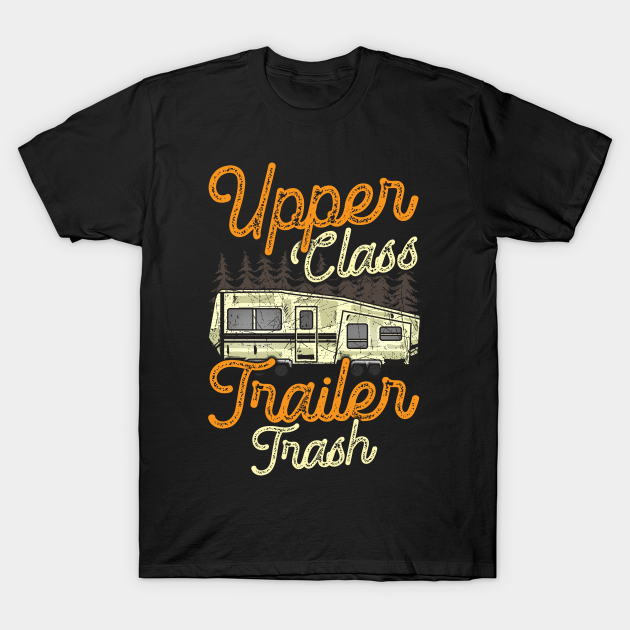
The width and height of the screenshot is (630, 630). What are the coordinates of `trash` in the screenshot? It's located at (315, 440).